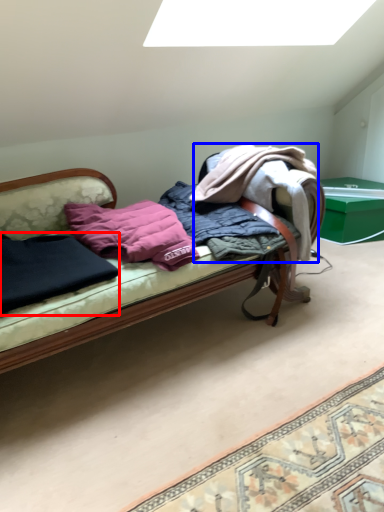
Question: Which point is further to the camera, clothing (highlighted by a red box) or clothing (highlighted by a blue box)?

Choices:
 (A) clothing
 (B) clothing

Answer: (B)